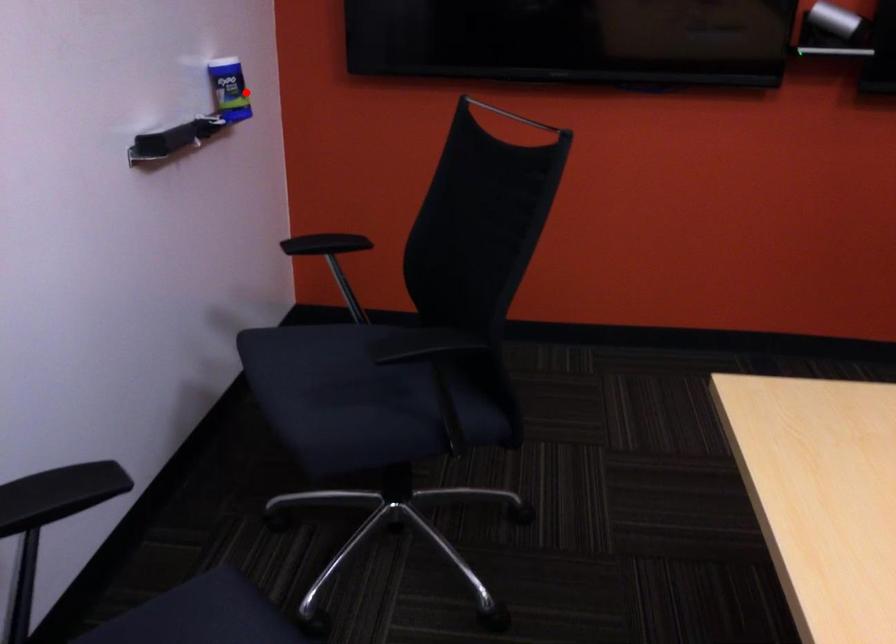
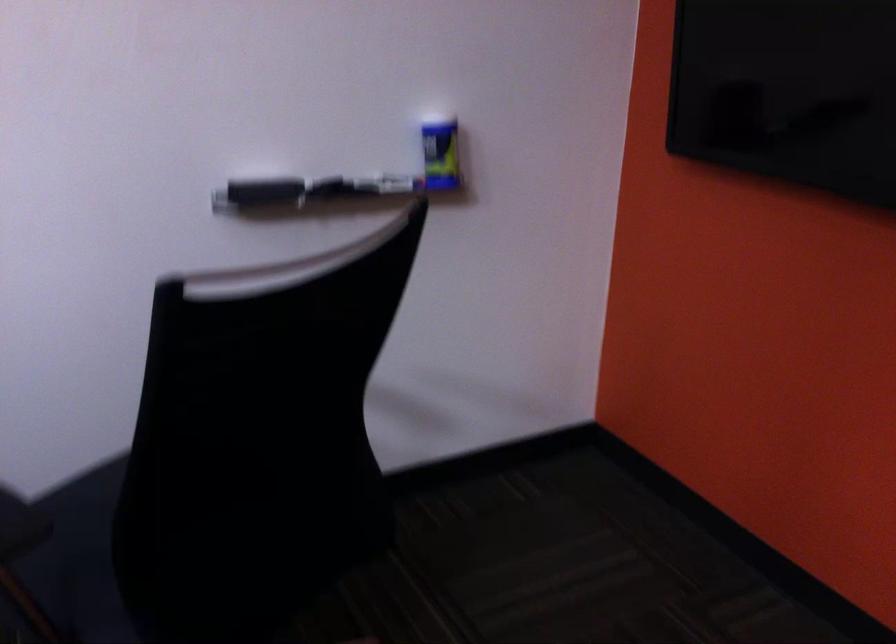
Question: A red point is marked in image1. In image2, is the corresponding 3D point closer to the camera or farther? Reply with the corresponding letter.

Choices:
 (A) The corresponding 3D point is closer.
 (B) The corresponding 3D point is farther.

Answer: (A)